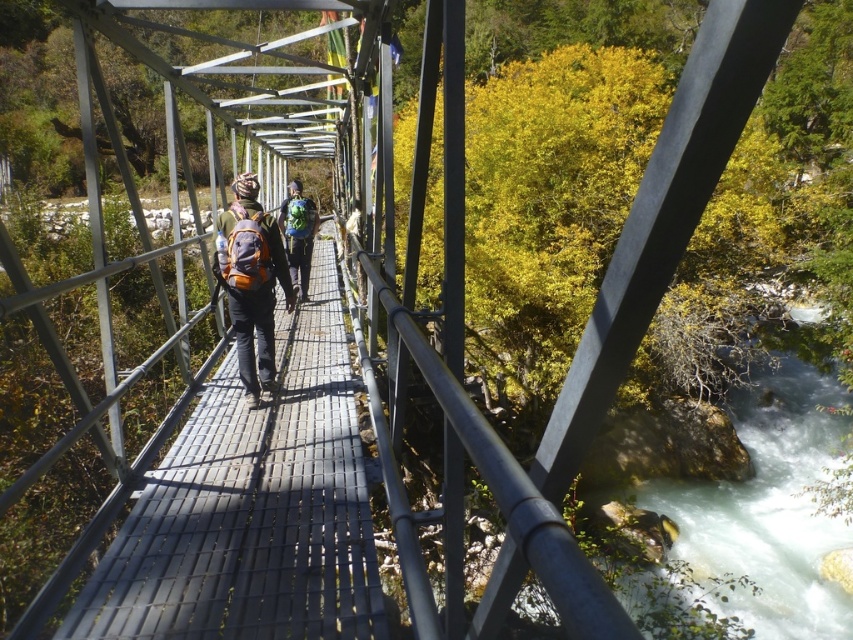
Is point (271, 365) behind point (283, 236)?

No, (271, 365) is in front of (283, 236).

Can you confirm if matte orange backpack at center is positioned below matte green backpack at center?

Yes.

Identify the location of matte orange backpack at center. Image resolution: width=853 pixels, height=640 pixels. (251, 282).